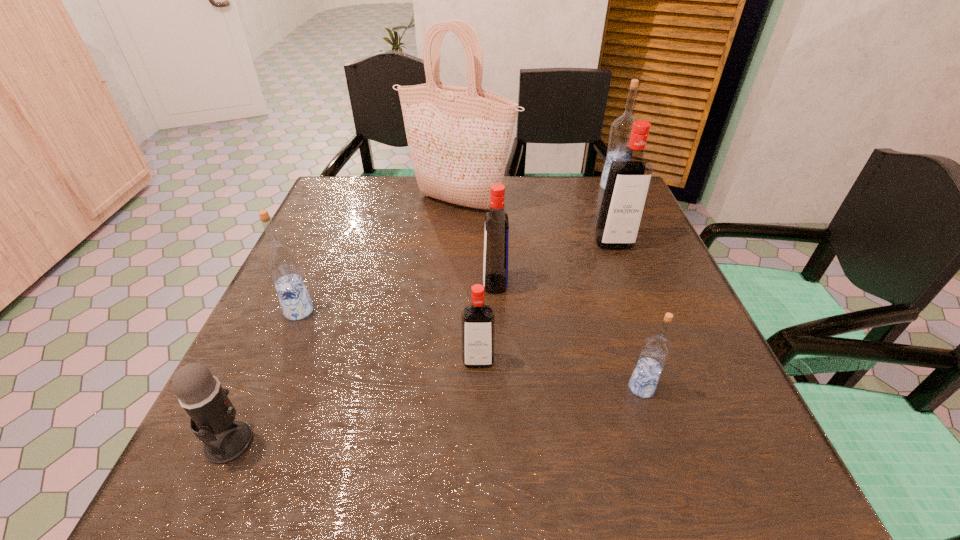
Identify the location of blank region between the fourth nearest vodka and the nearest vodka. (568, 336).

Where is `vacant area that lies between the smallest blue vodka and the tallest object`? Image resolution: width=960 pixels, height=540 pixels. vacant area that lies between the smallest blue vodka and the tallest object is located at coordinates (550, 295).

You are a GUI agent. You are given a task and a screenshot of the screen. Output one action in this format:
    pyautogui.click(x=<x>, y=<y>)
    Task: Click on the free space between the microphone and the smallest red vodka
    The height and width of the screenshot is (540, 960).
    Given the screenshot: What is the action you would take?
    pyautogui.click(x=353, y=401)

The width and height of the screenshot is (960, 540). What are the coordinates of `free space between the second blue vodka from left to right and the shopping bag` in the screenshot? It's located at (550, 295).

I want to click on object that ranks as the fifth closest to the biggest blue vodka, so click(477, 320).

Choose which object is the fifth nearest neighbor to the smallest red vodka. Please provide its 2D coordinates. Your answer should be formatted as a tuple, i.e. [(x, y)], where the tuple contains the x and y coordinates of a point satisfying the conditions above.

[(629, 177)]

Locate an element on the screen. This screenshot has height=540, width=960. vodka that can be found as the fourth closest to the second smallest red vodka is located at coordinates (280, 260).

Identify which vodka is the fourth nearest to the rightmost blue vodka. Please provide its 2D coordinates. Your answer should be formatted as a tuple, i.e. [(x, y)], where the tuple contains the x and y coordinates of a point satisfying the conditions above.

[(477, 320)]

This screenshot has width=960, height=540. In order to click on blue vodka object that ranks as the third closest to the tallest object in this screenshot , I will do `click(655, 351)`.

Locate an element on the screen. The width and height of the screenshot is (960, 540). blue vodka that stands as the closest to the rightmost red vodka is located at coordinates (620, 131).